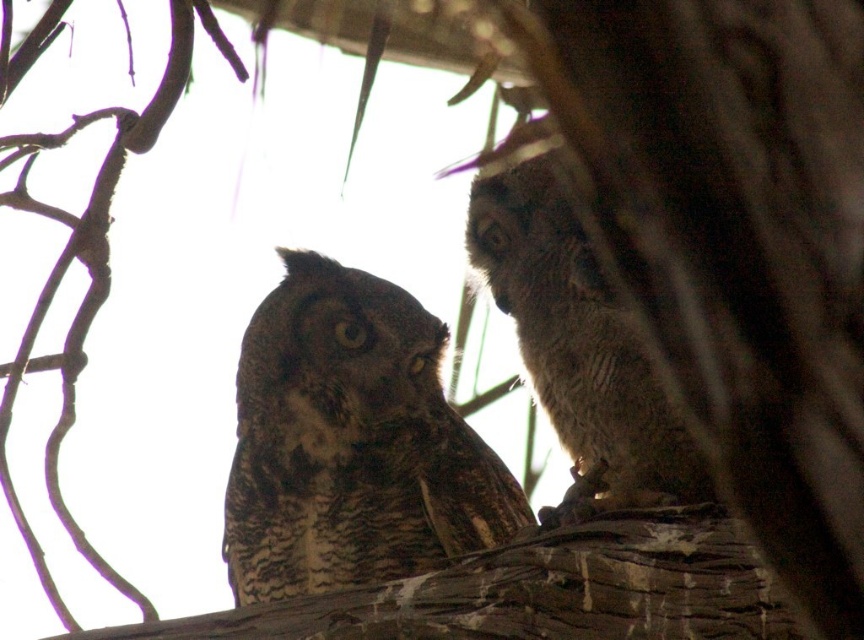
Question: Is brown speckled owl at center positioned at the back of speckled brown owl at right?

Choices:
 (A) yes
 (B) no

Answer: (A)

Question: Which of the following is the farthest from the observer?

Choices:
 (A) speckled brown owl at right
 (B) brown speckled owl at center

Answer: (B)

Question: Does brown speckled owl at center have a greater width compared to speckled brown owl at right?

Choices:
 (A) no
 (B) yes

Answer: (B)

Question: Which of the following is the closest to the observer?

Choices:
 (A) (678, 467)
 (B) (332, 394)

Answer: (A)

Question: In this image, where is brown speckled owl at center located relative to speckled brown owl at right?

Choices:
 (A) left
 (B) right

Answer: (A)